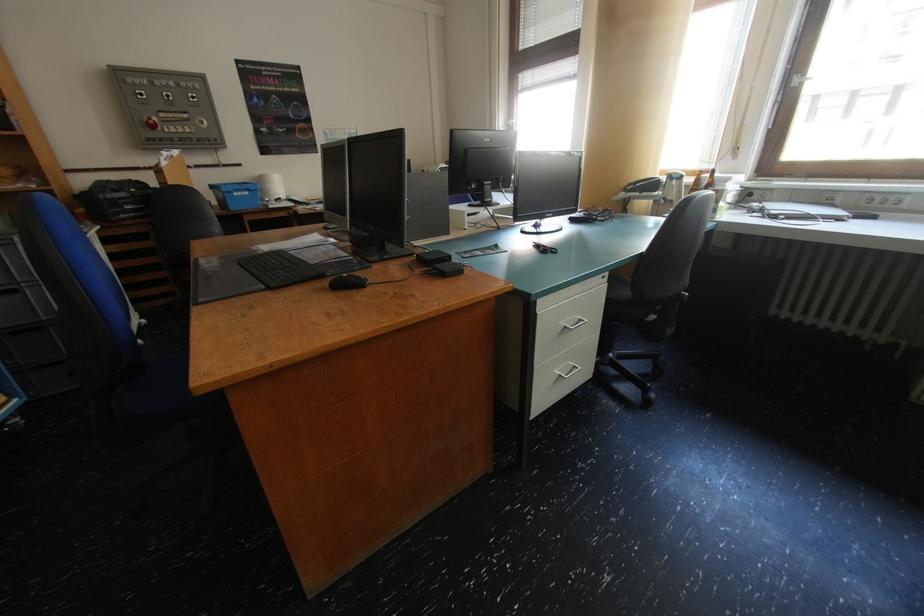
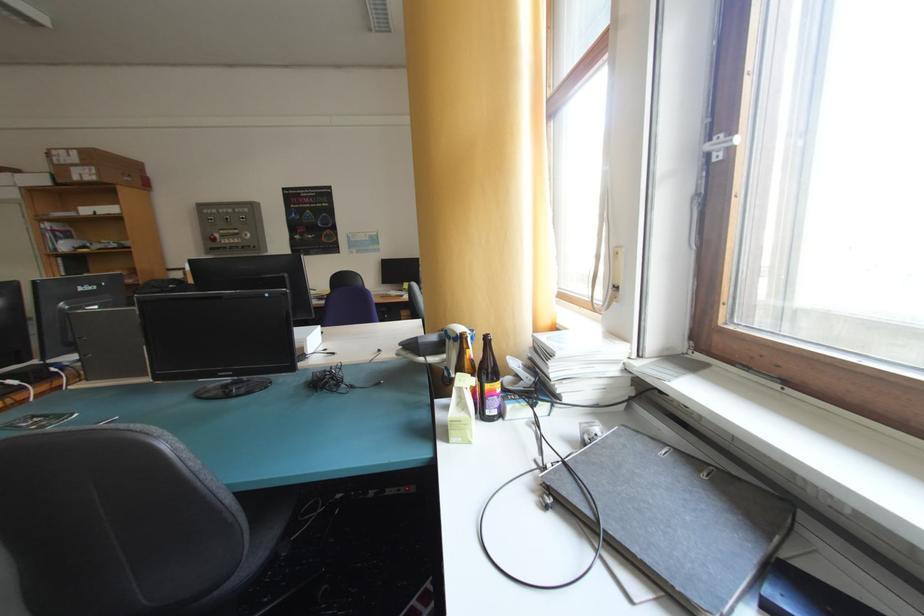
Locate, in the second image, the point that corresponds to the point at 682,177 in the first image.

(457, 334)